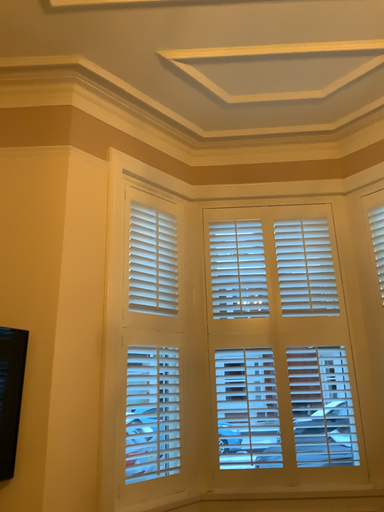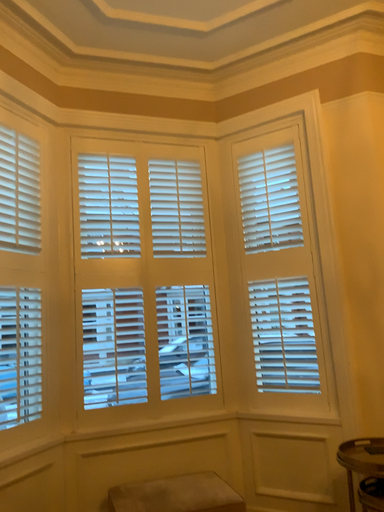
Question: How did the camera likely rotate when shooting the video?

Choices:
 (A) rotated left
 (B) rotated right

Answer: (B)